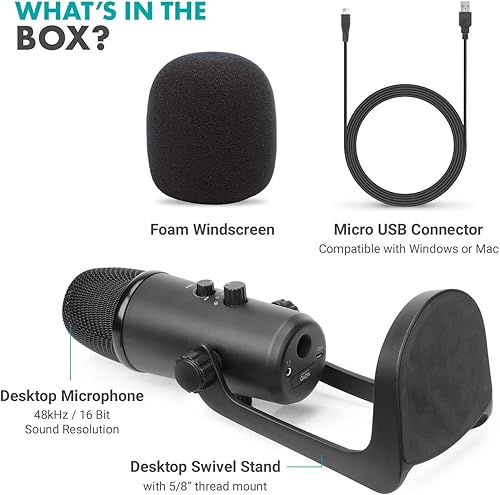
I want to click on speaker, so click(x=185, y=154).